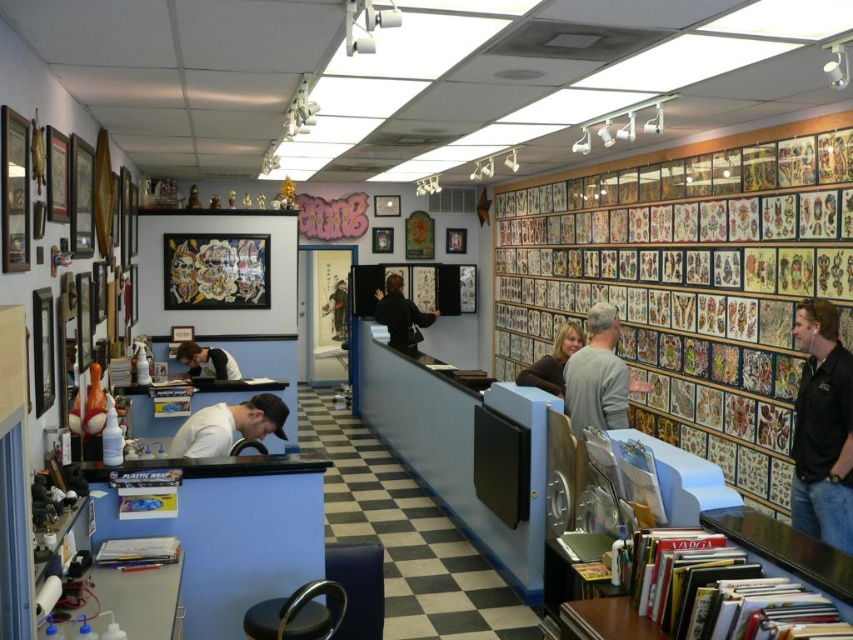
Question: Can you confirm if black leather stool at lower center is positioned above matte brown hair at center?

Choices:
 (A) yes
 (B) no

Answer: (B)

Question: Which is farther from the black leather jacket at right?

Choices:
 (A) gray sweater at center
 (B) matte black shirt at lower left
 (C) white matte shirt at lower left
 (D) matte black jacket at center

Answer: (B)

Question: Does black leather jacket at right appear on the right side of matte brown hair at center?

Choices:
 (A) no
 (B) yes

Answer: (B)

Question: Among these objects, which one is nearest to the camera?

Choices:
 (A) black leather stool at lower center
 (B) matte black jacket at center

Answer: (A)

Question: Can you confirm if black leather jacket at right is smaller than gray sweater at center?

Choices:
 (A) no
 (B) yes

Answer: (A)

Question: Which of these objects is positioned closest to the matte black jacket at center?

Choices:
 (A) black leather stool at lower center
 (B) white matte shirt at lower left
 (C) matte black shirt at lower left
 (D) black leather jacket at right

Answer: (C)